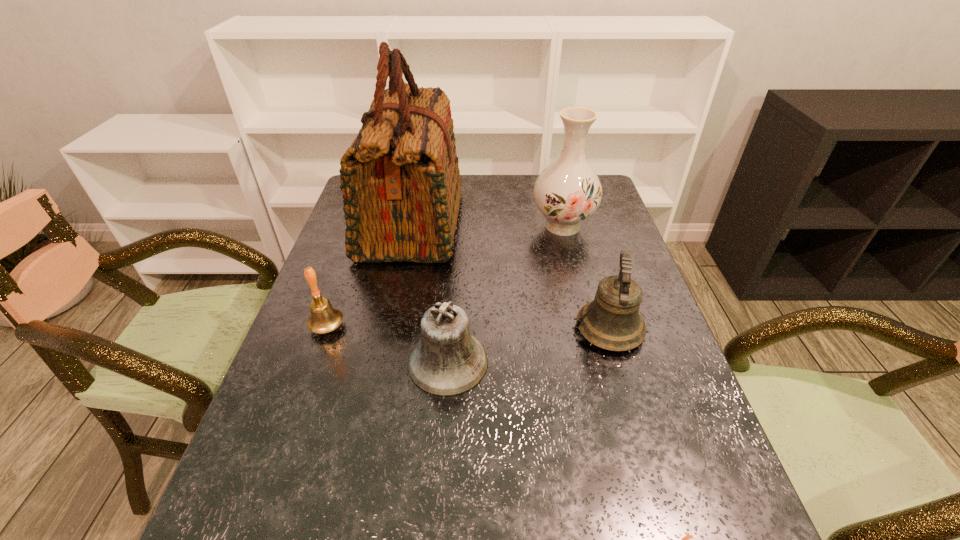
The height and width of the screenshot is (540, 960). I want to click on vacant space at the right edge, so click(x=624, y=238).

Locate an element on the screen. free space at the far right corner of the desktop is located at coordinates (606, 208).

Where is `free spot between the second bell from right to left and the leftmost bell`? Image resolution: width=960 pixels, height=540 pixels. free spot between the second bell from right to left and the leftmost bell is located at coordinates (388, 345).

Where is `empty space between the rightmost bell and the tallest object`? The image size is (960, 540). empty space between the rightmost bell and the tallest object is located at coordinates (511, 276).

This screenshot has height=540, width=960. What are the coordinates of `empty space between the leftmost bell and the shopping bag` in the screenshot? It's located at (370, 275).

The image size is (960, 540). In order to click on free space between the leftmost bell and the shopping bag in this screenshot , I will do `click(370, 275)`.

The height and width of the screenshot is (540, 960). I want to click on vacant point located between the second bell from left to right and the leftmost bell, so click(388, 345).

Identify which object is located as the fifth nearest to the tallest object. Please provide its 2D coordinates. Your answer should be formatted as a tuple, i.e. [(x, y)], where the tuple contains the x and y coordinates of a point satisfying the conditions above.

[(688, 539)]

Locate an element on the screen. Image resolution: width=960 pixels, height=540 pixels. the third closest object to the rightmost bell is located at coordinates (400, 179).

Identify which bell is located as the third nearest to the nearest object. Please provide its 2D coordinates. Your answer should be formatted as a tuple, i.e. [(x, y)], where the tuple contains the x and y coordinates of a point satisfying the conditions above.

[(324, 318)]